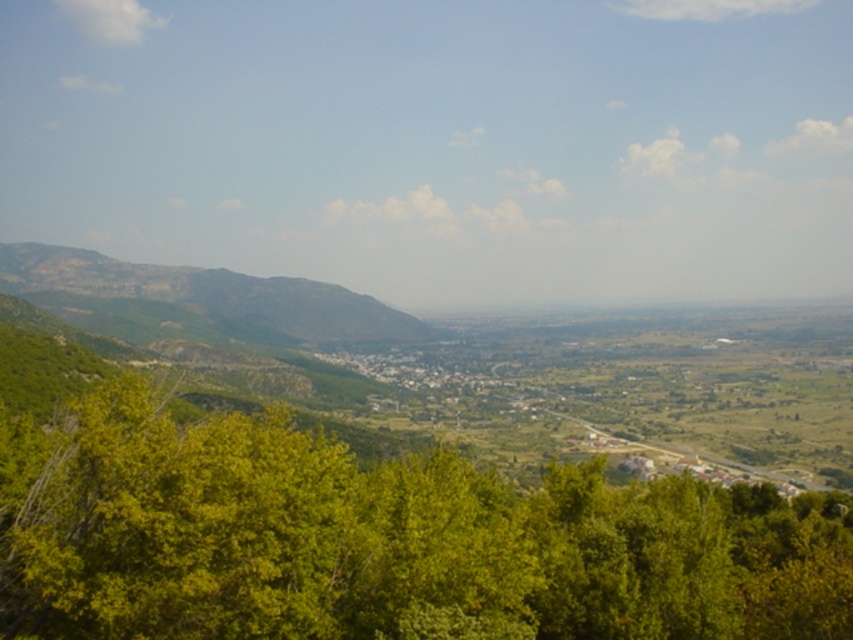
Consider the image. You are standing at the edge of the valley looking out. You see the green leafy tree at lower center and the rocky brown mountain at left. Which object is closer to your viewpoint?

The green leafy tree at lower center is closer to your viewpoint because it is positioned below the rocky brown mountain at left, indicating it is in the foreground.

You are planning to hike from the green leafy tree at lower center to the rocky brown mountain at left. Based on the distance provided, would you estimate this hike to be a short walk or a long trek?

The distance between the green leafy tree at lower center and the rocky brown mountain at left is 1552.58 feet, which is approximately 0.3 miles. This would be considered a short walk rather than a long trek.

You are planning to set up a tent in the valley. You need to choose between the area near the green leafy tree at lower center and the rocky brown mountain at left. Which location offers more space for your tent based on their sizes?

The rocky brown mountain at left is wider than the green leafy tree at lower center, so the area near the rocky brown mountain at left offers more space for your tent.